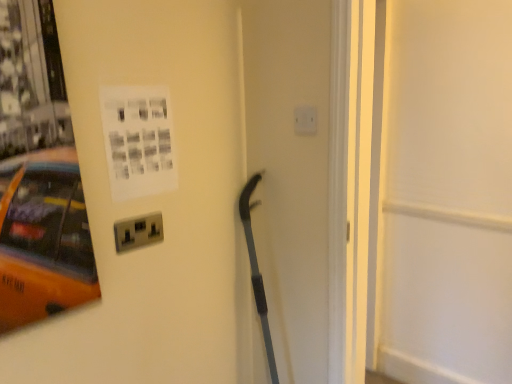
Question: Is white plastic electric outlet at upper center, which appears as the 1th electric outlet when viewed from the right, shorter than white matte door at center?

Choices:
 (A) yes
 (B) no

Answer: (A)

Question: Is white plastic electric outlet at upper center, which appears as the 1th electric outlet when viewed from the right, to the right of white matte door at center from the viewer's perspective?

Choices:
 (A) no
 (B) yes

Answer: (A)

Question: Can you confirm if white plastic electric outlet at upper center, which is the second electric outlet in front-to-back order, is thinner than white matte door at center?

Choices:
 (A) yes
 (B) no

Answer: (A)

Question: Considering the relative sizes of white plastic electric outlet at upper center, which appears as the 1th electric outlet when viewed from the right, and white matte door at center in the image provided, is white plastic electric outlet at upper center, which appears as the 1th electric outlet when viewed from the right, bigger than white matte door at center?

Choices:
 (A) no
 (B) yes

Answer: (A)

Question: Is white plastic electric outlet at center-left, which is the 2th electric outlet from top to bottom, to the left or to the right of white matte door at center in the image?

Choices:
 (A) right
 (B) left

Answer: (B)

Question: Considering the positions of point (143, 241) and point (407, 178), is point (143, 241) closer or farther from the camera than point (407, 178)?

Choices:
 (A) farther
 (B) closer

Answer: (B)

Question: From the image's perspective, is white plastic electric outlet at center-left, the 2th electric outlet positioned from the right, positioned above or below white matte door at center?

Choices:
 (A) below
 (B) above

Answer: (A)

Question: Considering the positions of white plastic electric outlet at center-left, which is the first electric outlet in bottom-to-top order, and white matte door at center in the image, is white plastic electric outlet at center-left, which is the first electric outlet in bottom-to-top order, bigger or smaller than white matte door at center?

Choices:
 (A) small
 (B) big

Answer: (A)

Question: In the image, is white paper at upper left on the left side or the right side of white plastic electric outlet at upper center, which is the second electric outlet in front-to-back order?

Choices:
 (A) right
 (B) left

Answer: (B)

Question: Do you think white paper at upper left is within white plastic electric outlet at upper center, the second electric outlet in the left-to-right sequence, or outside of it?

Choices:
 (A) inside
 (B) outside

Answer: (B)

Question: Is white paper at upper left wider or thinner than white plastic electric outlet at upper center, which is the second electric outlet in front-to-back order?

Choices:
 (A) thin
 (B) wide

Answer: (A)

Question: From the image's perspective, is white paper at upper left located above or below white plastic electric outlet at upper center, which is the 1th electric outlet from top to bottom?

Choices:
 (A) above
 (B) below

Answer: (B)

Question: From the image's perspective, relative to white paper at upper left, is white plastic electric outlet at upper center, which appears as the 1th electric outlet when viewed from the right, above or below?

Choices:
 (A) above
 (B) below

Answer: (A)

Question: From a real-world perspective, relative to white paper at upper left, is white plastic electric outlet at upper center, the second electric outlet in the left-to-right sequence, vertically above or below?

Choices:
 (A) below
 (B) above

Answer: (B)